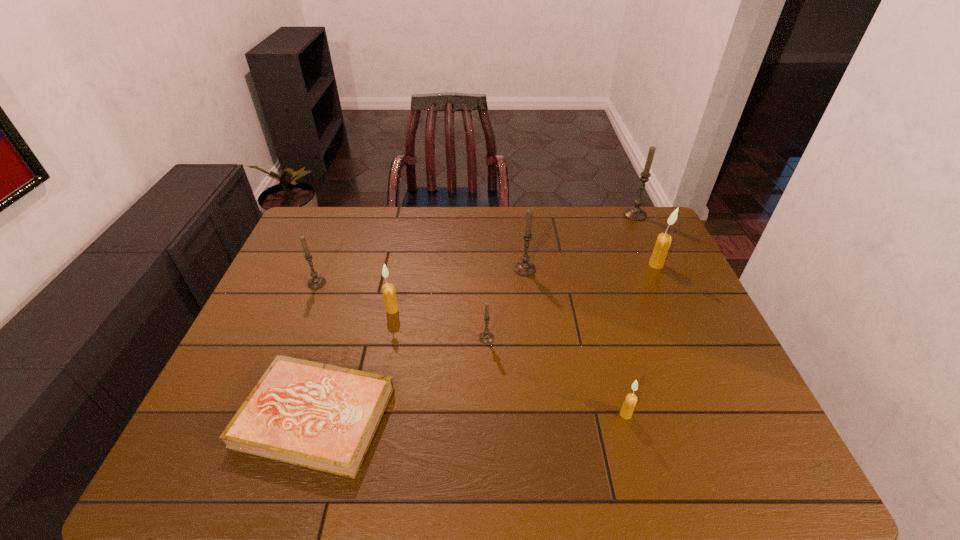
The image size is (960, 540). What are the coordinates of `the farthest object` in the screenshot? It's located at (635, 213).

Image resolution: width=960 pixels, height=540 pixels. Find the location of `the tallest candle`. the tallest candle is located at coordinates (635, 213).

Where is `the third gray candle from left to right`? Image resolution: width=960 pixels, height=540 pixels. the third gray candle from left to right is located at coordinates (524, 268).

You are a GUI agent. You are given a task and a screenshot of the screen. Output one action in this format:
    pyautogui.click(x=<x>, y=<y>)
    Task: Click on the fourth candle from left to right
    
    Given the screenshot: What is the action you would take?
    pyautogui.click(x=524, y=268)

The height and width of the screenshot is (540, 960). What are the coordinates of `the biggest cream candle` in the screenshot? It's located at (663, 242).

Locate an element on the screen. Image resolution: width=960 pixels, height=540 pixels. the farthest cream candle is located at coordinates (663, 242).

Identify the location of the second nearest cream candle. (389, 293).

The image size is (960, 540). I want to click on the leftmost cream candle, so click(389, 293).

Where is `the fourth nearest candle`? This screenshot has width=960, height=540. the fourth nearest candle is located at coordinates (316, 282).

Find the location of a particular element. the second smallest gray candle is located at coordinates (316, 282).